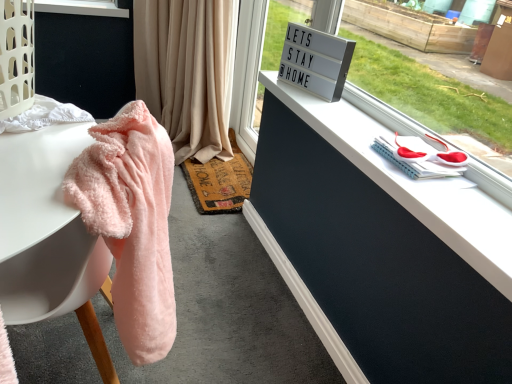
Where is `vacant region to the right of fluffy pink towel at left`? This screenshot has height=384, width=512. vacant region to the right of fluffy pink towel at left is located at coordinates (223, 343).